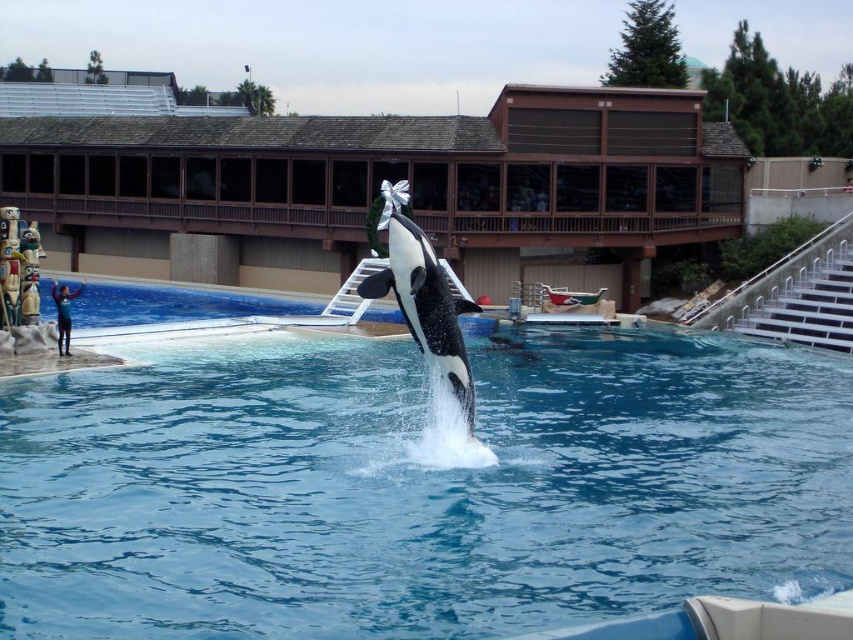
You are standing at the edge of the pool in the marine park. There is a point marked at coordinates (418, 486). Based on the scene description, where is this point located?

The point (418, 486) is on the blue smooth water at center.

You are a photographer standing at the edge of the marine park pool. You want to capture a close shot of the blue smooth water at center. Given that your camera can focus on objects within 10 meters, will you need to adjust your position to get a clear photo?

The blue smooth water at center is 10.34 meters away from the camera, which is slightly beyond the camera focus range of 10 meters. You need to move closer to ensure the blue smooth water at center is within the 10 meter focus range for a clear photo.

You are standing at the origin point of the coordinate system in the image. The orca is jumping out of the water at the blue smooth water at center. Can you determine the direction the orca is jumping relative to your position?

The blue smooth water at center is located at coordinate point (418, 486). Since the orca is jumping out of the water at this point, it would be jumping towards the upper right direction from your position at the origin.